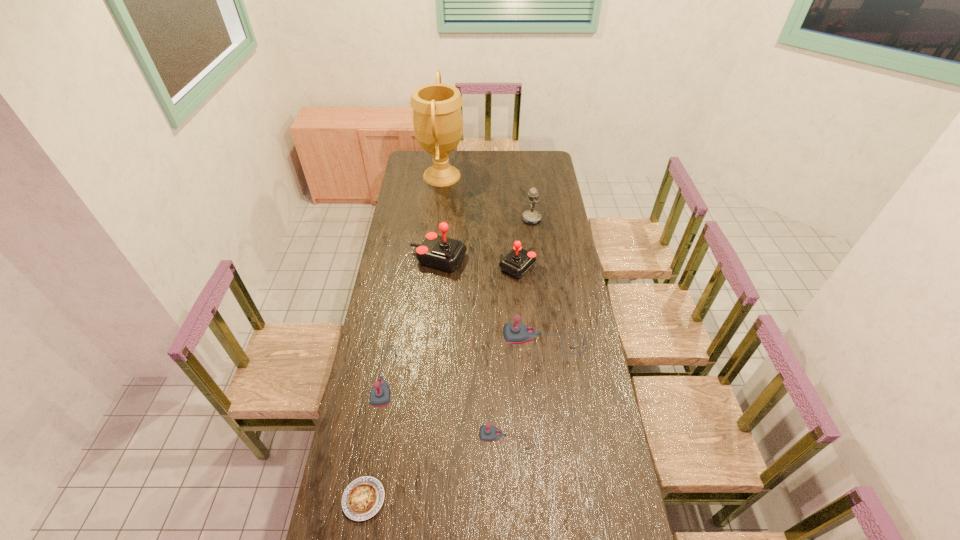
At what (x,y) coordinates should I click in order to perform the action: click on the sixth tallest object. Please return your answer as a coordinate pair (x, y). The height and width of the screenshot is (540, 960). Looking at the image, I should click on (380, 394).

You are a GUI agent. You are given a task and a screenshot of the screen. Output one action in this format:
    pyautogui.click(x=<x>, y=<y>)
    Task: Click on the nearest gray joystick
    This screenshot has height=540, width=960.
    Given the screenshot: What is the action you would take?
    pyautogui.click(x=487, y=433)

Find the location of a particular element. The image size is (960, 540). the third shortest object is located at coordinates point(487,433).

At what (x,y) coordinates should I click in order to perform the action: click on the second nearest object. Please return your answer as a coordinate pair (x, y). Looking at the image, I should click on (362, 499).

Find the location of a particular element. the eighth tallest object is located at coordinates (362, 499).

Locate an element on the screen. Image resolution: width=960 pixels, height=540 pixels. vacant space located 0.200m on the engravings side of the tallest object is located at coordinates (498, 176).

The image size is (960, 540). I want to click on free spot located on the right of the left red joystick, so (x=483, y=259).

Identify the location of vacant space located on the front-facing side of the second farthest object. (457, 219).

Locate an element on the screen. Image resolution: width=960 pixels, height=540 pixels. vacant space located 0.230m on the front-facing side of the second farthest object is located at coordinates (479, 219).

Image resolution: width=960 pixels, height=540 pixels. Find the location of `vacant area located on the front-facing side of the second farthest object`. vacant area located on the front-facing side of the second farthest object is located at coordinates (451, 219).